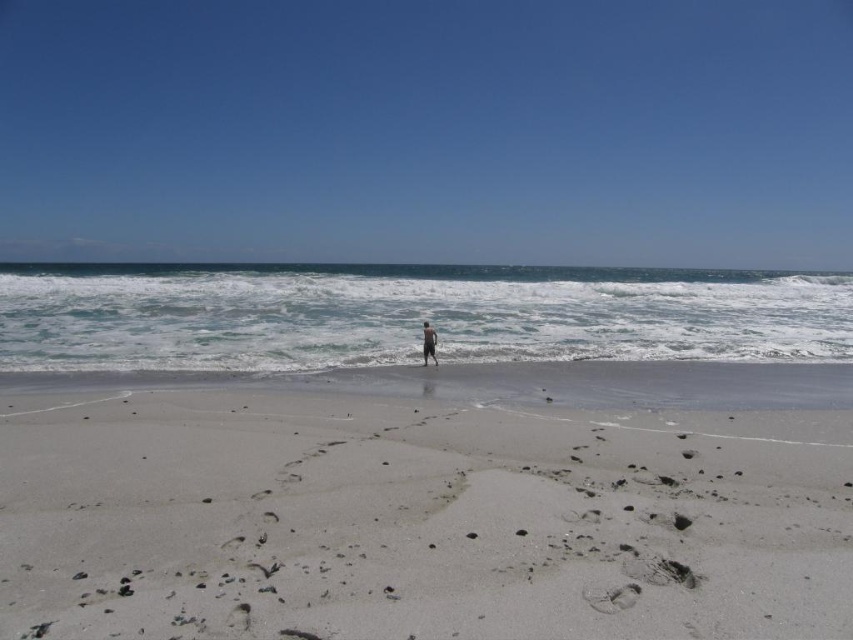
Which is more to the right, white sandy beach at center or tan skin person at center?

tan skin person at center

The width and height of the screenshot is (853, 640). What do you see at coordinates (415, 518) in the screenshot?
I see `white sandy beach at center` at bounding box center [415, 518].

The height and width of the screenshot is (640, 853). What are the coordinates of `white sandy beach at center` in the screenshot? It's located at (415, 518).

Locate an element on the screen. This screenshot has height=640, width=853. white sandy beach at center is located at coordinates (415, 518).